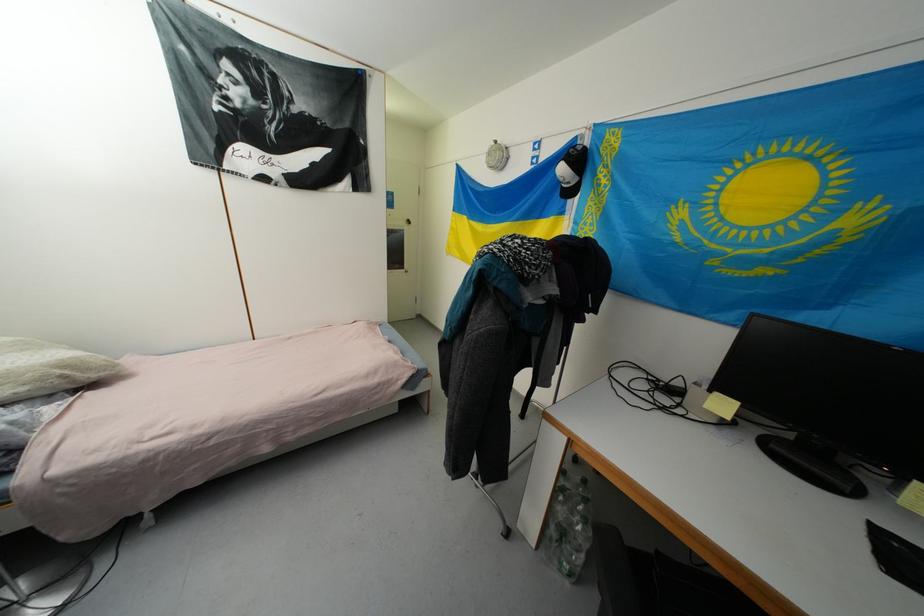
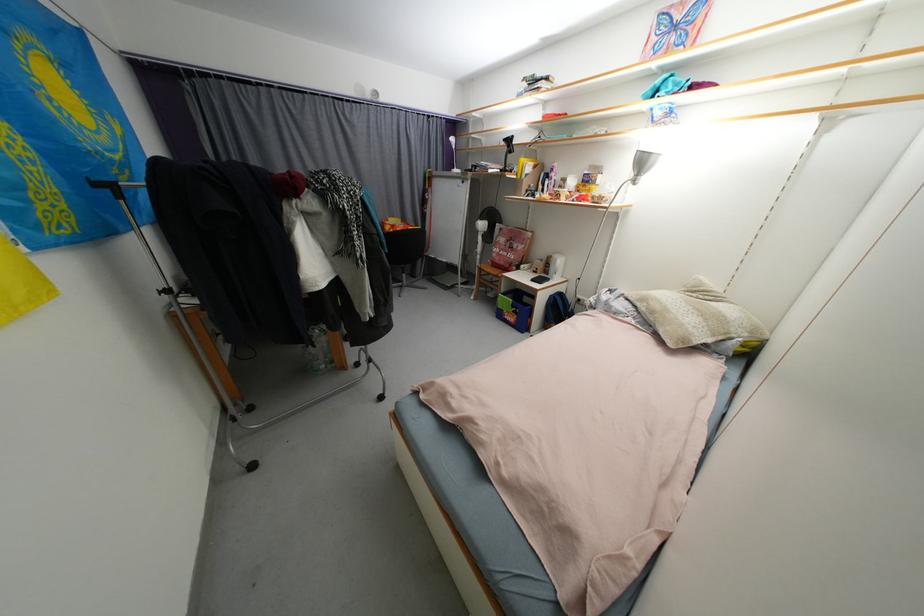
Find the pixel in the second image that matches [46,381] in the first image.

(658, 314)